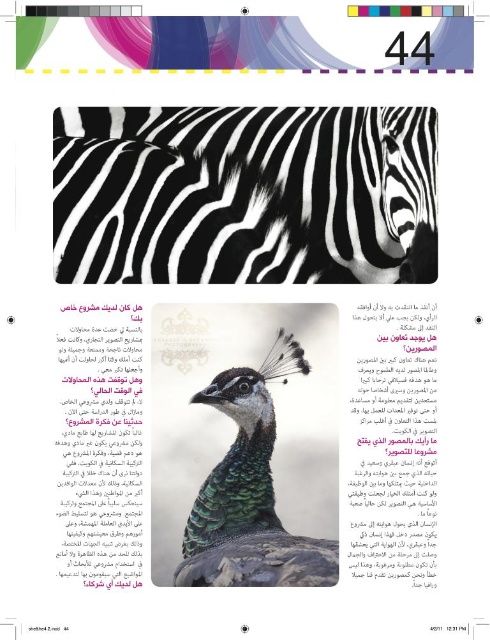
Question: Is black and white stripes at center to the left of shiny green peacock at center from the viewer's perspective?

Choices:
 (A) yes
 (B) no

Answer: (A)

Question: Among these objects, which one is farthest from the camera?

Choices:
 (A) shiny green peacock at center
 (B) black and white stripes at center

Answer: (B)

Question: Does black and white stripes at center appear on the right side of shiny green peacock at center?

Choices:
 (A) no
 (B) yes

Answer: (A)

Question: Does black and white stripes at center have a lesser width compared to shiny green peacock at center?

Choices:
 (A) no
 (B) yes

Answer: (A)